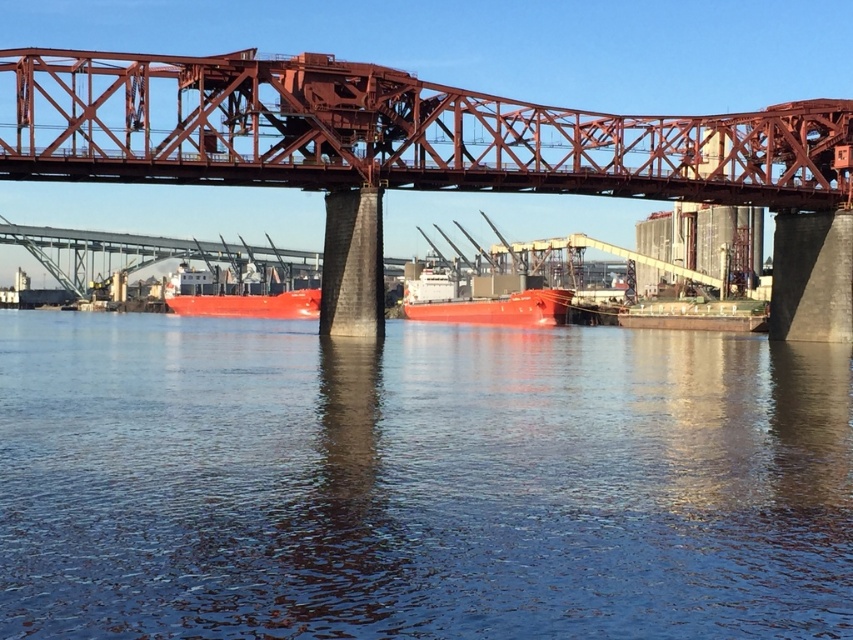
You are standing at the base of the red steel bridge and want to reach a specific location. You have two points to choose from, point (434, 314) and point (225, 291). Which point is closer to you?

Point (434, 314) is closer to the viewer than point (225, 291), so you should choose point (434, 314) as it is nearer to your current position at the base of the red steel bridge.

You are a photographer positioned on the bridge and want to capture both the smooth matte red ship at center and the smooth red ship at center in a single shot. Which ship should you focus on first to ensure both are in frame?

You should focus on the smooth matte red ship at center first since it is closer to you than the smooth red ship at center, allowing both to be captured in the frame.